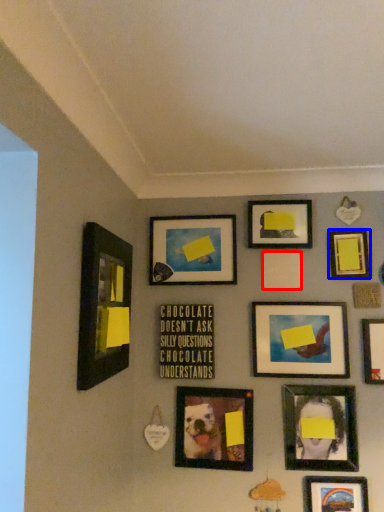
Question: Which object is closer to the camera taking this photo, picture frame (highlighted by a red box) or picture frame (highlighted by a blue box)?

Choices:
 (A) picture frame
 (B) picture frame

Answer: (B)